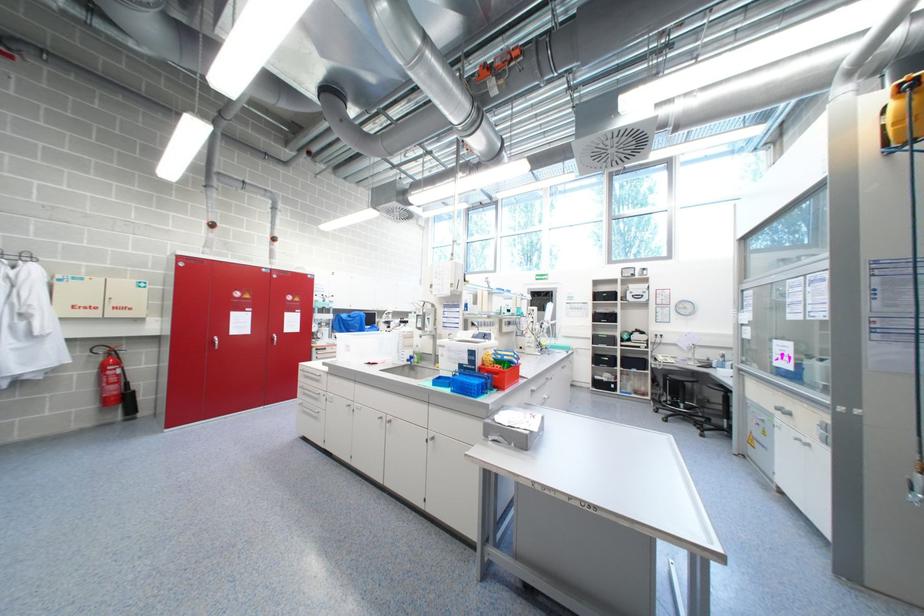
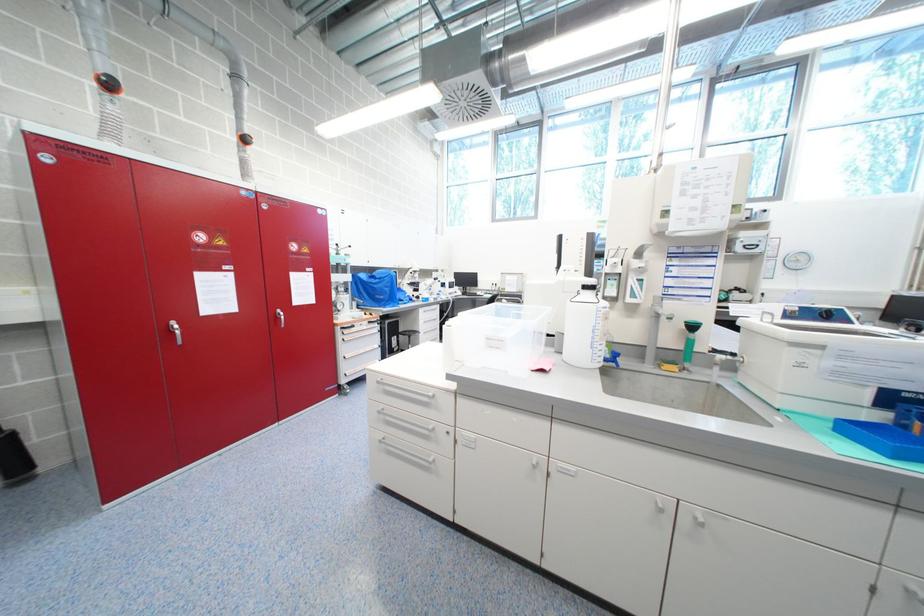
In a continuous first-person perspective shot, in which direction is the camera moving?

The cameraman walked toward left, forward.